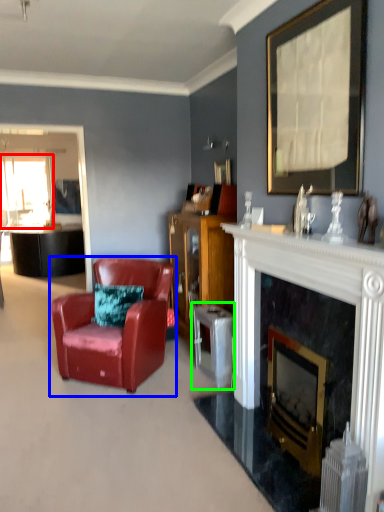
Question: Estimate the real-world distances between objects in this image. Which object is farther from window screen (highlighted by a red box), chair (highlighted by a blue box) or table (highlighted by a green box)?

Choices:
 (A) chair
 (B) table

Answer: (B)